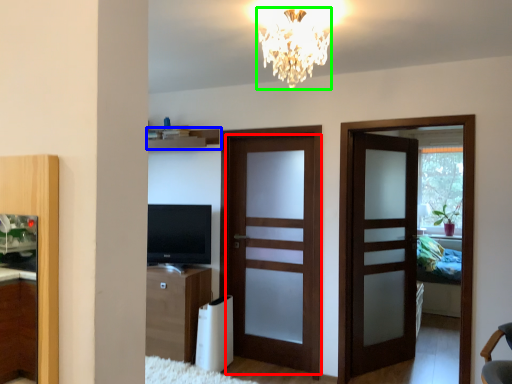
Question: Considering the real-world distances, which object is closest to door (highlighted by a red box)? shelf (highlighted by a blue box) or lamp (highlighted by a green box).

Choices:
 (A) shelf
 (B) lamp

Answer: (A)